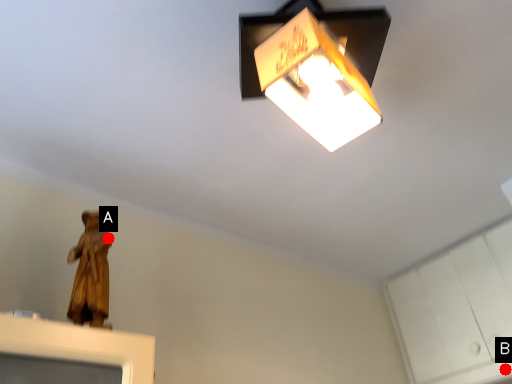
Question: Two points are circled on the image, labeled by A and B beside each circle. Which point is further to the camera?

Choices:
 (A) A is further
 (B) B is further

Answer: (B)